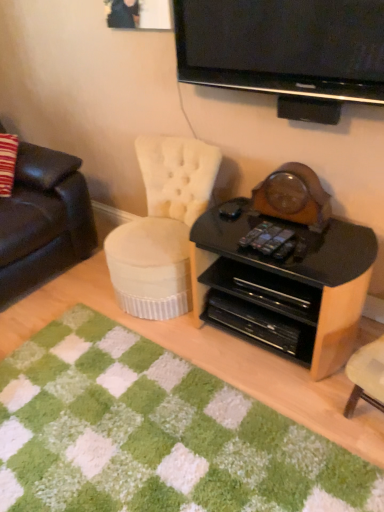
At what (x,y) coordinates should I click in order to perform the action: click on green shaggy rug at lower center. Please return your answer as a coordinate pair (x, y). Looking at the image, I should click on (154, 434).

At what (x,y) coordinates should I click in order to perform the action: click on black plastic remote control at center. Please return your answer as a coordinate pair (x, y). The image size is (384, 512). Looking at the image, I should click on (268, 239).

This screenshot has width=384, height=512. I want to click on black plastic drawer at center, so click(264, 289).

The image size is (384, 512). In order to click on leather couch at left in this screenshot , I will do click(43, 221).

This screenshot has width=384, height=512. Describe the element at coordinates (284, 47) in the screenshot. I see `black glossy television at upper center` at that location.

The height and width of the screenshot is (512, 384). What do you see at coordinates (283, 283) in the screenshot?
I see `black glossy desk at center` at bounding box center [283, 283].

The width and height of the screenshot is (384, 512). I want to click on green shaggy rug at lower center, so click(154, 434).

How different are the orientations of white tufted fabric chair at center and black plastic drawer at center in degrees?

They differ by 4.51 degrees in their facing directions.

Locate an element on the screen. chair that is above the black plastic drawer at center (from a real-world perspective) is located at coordinates (162, 227).

Is white tufted fabric chair at center placed right next to black plastic drawer at center?

white tufted fabric chair at center is not next to black plastic drawer at center, and they're not touching.

From a real-world perspective, who is located lower, white tufted fabric chair at center or black plastic drawer at center?

black plastic drawer at center is physically lower.

Who is more distant, black plastic remote control at center or green shaggy rug at lower center?

black plastic remote control at center is further away from the camera.

Is green shaggy rug at lower center at the back of black plastic remote control at center?

No, black plastic remote control at center's orientation is not away from green shaggy rug at lower center.

Is black plastic remote control at center situated inside green shaggy rug at lower center or outside?

black plastic remote control at center is outside green shaggy rug at lower center.

Between point (290, 238) and point (139, 354), which one is positioned in front?

The point (290, 238) is more forward.

Find the location of `television on the right of green shaggy rug at lower center`. television on the right of green shaggy rug at lower center is located at coordinates (284, 47).

From the picture: Considering the sizes of objects green shaggy rug at lower center and black glossy television at upper center in the image provided, who is wider, green shaggy rug at lower center or black glossy television at upper center?

Wider between the two is green shaggy rug at lower center.

What's the angular difference between green shaggy rug at lower center and black glossy television at upper center's facing directions?

They differ by 91.7 degrees in their facing directions.

From the image's perspective, between green shaggy rug at lower center and black glossy television at upper center, which one is located above?

black glossy television at upper center, from the image's perspective.

Which object is positioned more to the right, green shaggy rug at lower center or black plastic drawer at center?

From the viewer's perspective, black plastic drawer at center appears more on the right side.

Does green shaggy rug at lower center contain black plastic drawer at center?

That's incorrect, black plastic drawer at center is not inside green shaggy rug at lower center.

Where is `drawer on the right of green shaggy rug at lower center`? Image resolution: width=384 pixels, height=512 pixels. drawer on the right of green shaggy rug at lower center is located at coordinates (264, 289).

Is the depth of green shaggy rug at lower center less than that of black plastic drawer at center?

That is True.

Which is behind, point (245, 441) or point (178, 237)?

The point (178, 237) is behind.

Is green shaggy rug at lower center spatially inside white tufted fabric chair at center, or outside of it?

green shaggy rug at lower center is located beyond the bounds of white tufted fabric chair at center.

Looking at this image, is green shaggy rug at lower center turned away from white tufted fabric chair at center?

No, green shaggy rug at lower center is not facing away from white tufted fabric chair at center.

Identify the location of chair behind the green shaggy rug at lower center. (162, 227).

Does green shaggy rug at lower center have a larger size compared to black glossy desk at center?

No, green shaggy rug at lower center is not bigger than black glossy desk at center.

Are green shaggy rug at lower center and black glossy desk at center located far from each other?

green shaggy rug at lower center is near black glossy desk at center, not far away.

Can you confirm if green shaggy rug at lower center is positioned to the right of black glossy desk at center?

In fact, green shaggy rug at lower center is to the left of black glossy desk at center.

From a real-world perspective, relative to black glossy desk at center, is green shaggy rug at lower center vertically above or below?

From a real-world perspective, green shaggy rug at lower center is physically below black glossy desk at center.

Is black plastic remote control at center completely or partially inside white tufted fabric chair at center?

No, black plastic remote control at center is located outside of white tufted fabric chair at center.

Does white tufted fabric chair at center turn towards black plastic remote control at center?

No, white tufted fabric chair at center is not facing towards black plastic remote control at center.

Which point is more distant from viewer, (143, 255) or (266, 253)?

Positioned behind is point (143, 255).

There is a white tufted fabric chair at center. Identify the location of remote control above it (from a real-world perspective). (268, 239).

Image resolution: width=384 pixels, height=512 pixels. I want to click on chair that is above the black plastic drawer at center (from a real-world perspective), so click(x=162, y=227).

Locate an element on the screen. The image size is (384, 512). remote control to the right of green shaggy rug at lower center is located at coordinates (268, 239).

Estimate the real-world distances between objects in this image. Which object is closer to black glossy desk at center, black plastic remote control at center or black glossy television at upper center?

Based on the image, black plastic remote control at center appears to be nearer to black glossy desk at center.

Based on their spatial positions, is black glossy desk at center or black plastic drawer at center further from white tufted fabric chair at center?

black plastic drawer at center lies further to white tufted fabric chair at center than the other object.

Considering their positions, is black plastic remote control at center positioned further to leather couch at left than green shaggy rug at lower center?

Based on the image, black plastic remote control at center appears to be further to leather couch at left.

Which object lies further to the anchor point green shaggy rug at lower center, black glossy television at upper center or white tufted fabric chair at center?

black glossy television at upper center is positioned further to the anchor green shaggy rug at lower center.

Estimate the real-world distances between objects in this image. Which object is closer to leather couch at left, black glossy desk at center or green shaggy rug at lower center?

green shaggy rug at lower center.

Estimate the real-world distances between objects in this image. Which object is further from white tufted fabric chair at center, black plastic remote control at center or green shaggy rug at lower center?

green shaggy rug at lower center is positioned further to the anchor white tufted fabric chair at center.

Looking at the image, which one is located further to green shaggy rug at lower center, black glossy television at upper center or leather couch at left?

black glossy television at upper center lies further to green shaggy rug at lower center than the other object.

Considering their positions, is leather couch at left positioned closer to white tufted fabric chair at center than black plastic remote control at center?

Among the two, black plastic remote control at center is located nearer to white tufted fabric chair at center.

This screenshot has height=512, width=384. I want to click on chair between black glossy television at upper center and green shaggy rug at lower center from top to bottom, so click(x=162, y=227).

This screenshot has height=512, width=384. Identify the location of chair between leather couch at left and black plastic drawer at center. (162, 227).

Identify the location of remote control between black glossy television at upper center and black plastic drawer at center vertically. Image resolution: width=384 pixels, height=512 pixels. (268, 239).

Where is `remote control between white tufted fabric chair at center and green shaggy rug at lower center from top to bottom`? The width and height of the screenshot is (384, 512). remote control between white tufted fabric chair at center and green shaggy rug at lower center from top to bottom is located at coordinates (268, 239).